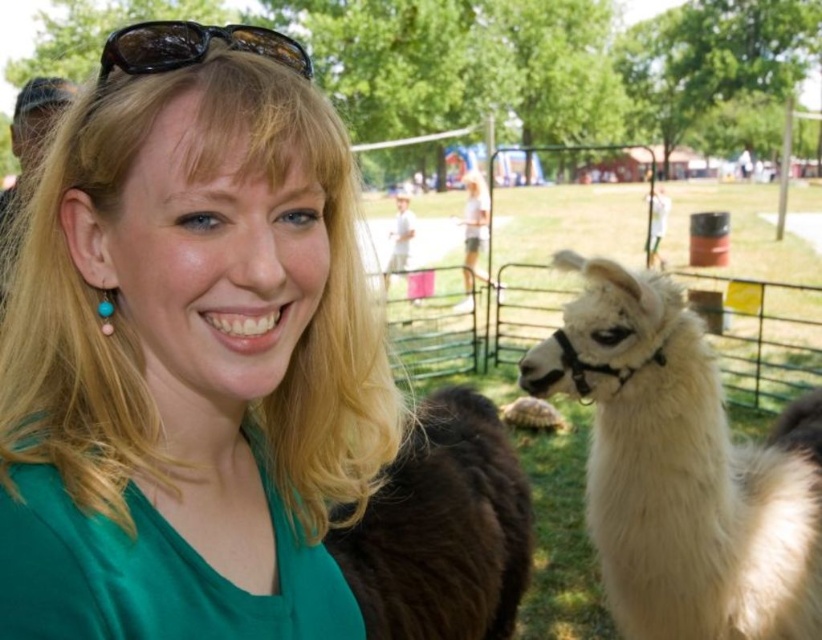
Between white fluffy alpaca at right and black shiny sunglasses at upper center, which one appears on the left side from the viewer's perspective?

Positioned to the left is black shiny sunglasses at upper center.

Is point (642, 461) positioned after point (192, 26)?

Yes, it is behind point (192, 26).

Who is more distant from viewer, (788, 628) or (141, 48)?

The point (788, 628) is more distant.

This screenshot has width=822, height=640. Find the location of `white fluffy alpaca at right`. white fluffy alpaca at right is located at coordinates (682, 468).

Who is taller, green silk shirt at upper left or black shiny sunglasses at upper center?

With more height is green silk shirt at upper left.

Consider the image. Is green silk shirt at upper left above black shiny sunglasses at upper center?

Actually, green silk shirt at upper left is below black shiny sunglasses at upper center.

Measure the distance between green silk shirt at upper left and camera.

green silk shirt at upper left is 67.52 centimeters from camera.

What are the coordinates of `green silk shirt at upper left` in the screenshot? It's located at (188, 355).

Is green silk shirt at upper left to the right of white fluffy alpaca at right from the viewer's perspective?

No, green silk shirt at upper left is not to the right of white fluffy alpaca at right.

Can you confirm if green silk shirt at upper left is positioned to the left of white fluffy alpaca at right?

Yes, green silk shirt at upper left is to the left of white fluffy alpaca at right.

Which is behind, point (256, 330) or point (654, 481)?

The point (654, 481) is more distant.

Where is `green silk shirt at upper left`? The width and height of the screenshot is (822, 640). green silk shirt at upper left is located at coordinates (188, 355).